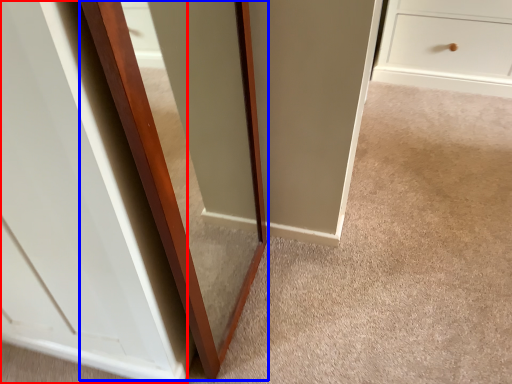
Question: Which point is further to the camera, glass door (highlighted by a red box) or glass door (highlighted by a blue box)?

Choices:
 (A) glass door
 (B) glass door

Answer: (B)